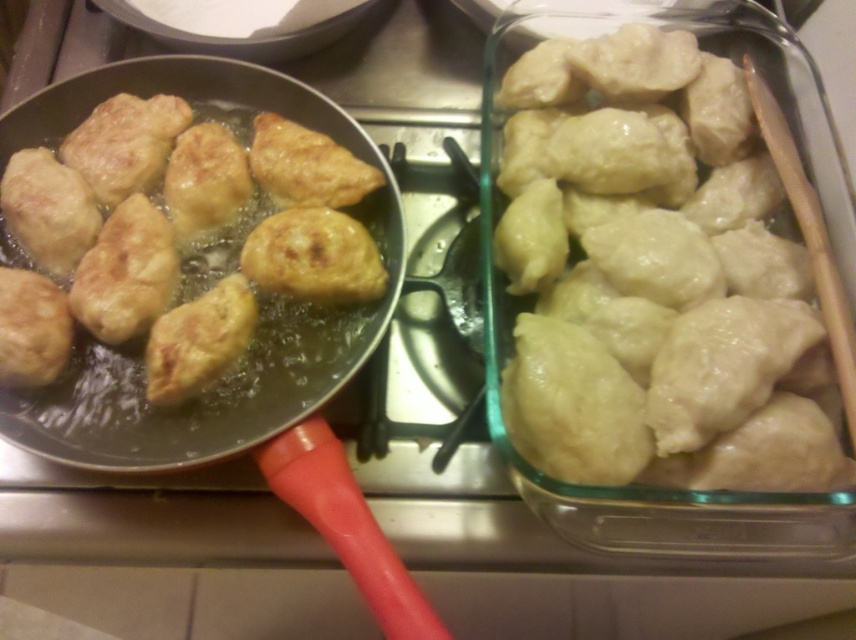
Question: Does glossy white dumplings at right have a larger size compared to golden brown dough at center?

Choices:
 (A) no
 (B) yes

Answer: (B)

Question: Can you confirm if golden brown dough at center is thinner than shiny metal pan at center?

Choices:
 (A) no
 (B) yes

Answer: (B)

Question: Which object appears closest to the camera in this image?

Choices:
 (A) golden brown dough at center
 (B) shiny metal pan at center
 (C) glossy white dumplings at right

Answer: (B)

Question: Is glossy white dumplings at right closer to camera compared to shiny metal pan at center?

Choices:
 (A) no
 (B) yes

Answer: (A)

Question: Based on their relative distances, which object is nearer to the shiny metal pan at center?

Choices:
 (A) glossy white dumplings at right
 (B) golden brown dough at center

Answer: (B)

Question: Which point appears closest to the camera in this image?

Choices:
 (A) (342, 236)
 (B) (768, 300)
 (C) (290, 476)

Answer: (C)